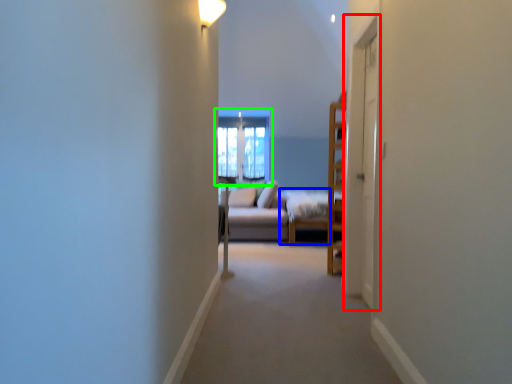
Question: Which object is positioned farthest from screen door (highlighted by a red box)? Select from bed frame (highlighted by a blue box) and window (highlighted by a green box).

Choices:
 (A) bed frame
 (B) window

Answer: (B)